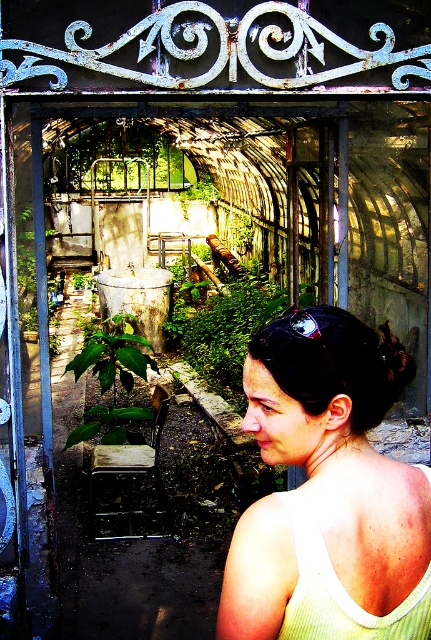
Which is behind, point (297, 448) or point (349, 598)?

Positioned behind is point (297, 448).

This screenshot has width=431, height=640. What are the coordinates of `light yellow knit tank top at center` in the screenshot? It's located at (328, 492).